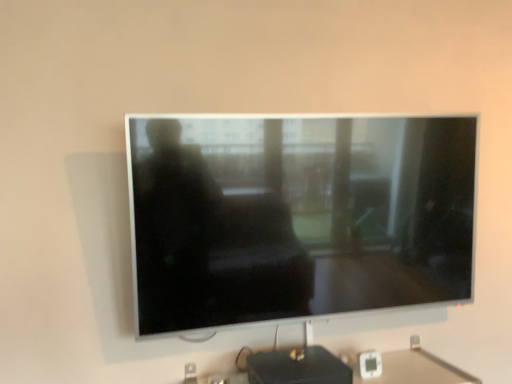
What do you see at coordinates (338, 369) in the screenshot? I see `black plastic router at lower center` at bounding box center [338, 369].

Where is `black plastic router at lower center`? black plastic router at lower center is located at coordinates (338, 369).

Identify the location of black plastic router at lower center. (338, 369).